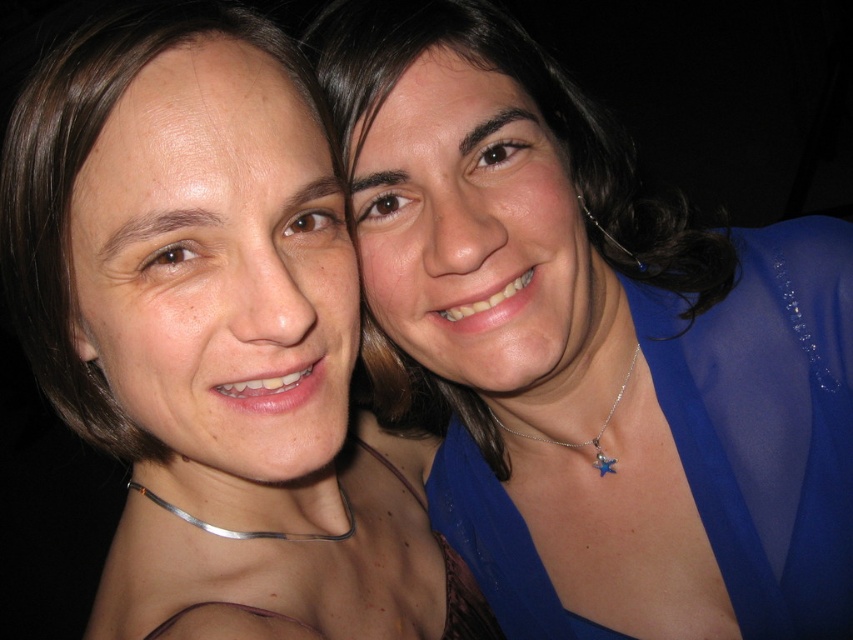
You are a photographer trying to adjust the lighting for a portrait. You notice the blue satin blouse at upper right is positioned at a certain coordinate. To ensure proper exposure, you need to know if the blouse is closer to the top or bottom of the frame. Can you determine this based on its position?

The blue satin blouse at upper right is located at point (x=213, y=339). Since the y coordinate 0.252 is closer to the top of the frame, the blouse is positioned closer to the top.

You are a photographer trying to adjust the spacing between the two blue satin garments in the image. The blue satin blouse at upper right and the blue satin dress at right are currently 9.58 inches apart. If you want to create a more cohesive look by reducing the distance between them, what is the minimum distance you should aim for to ensure they appear connected?

To ensure the blue satin blouse at upper right and the blue satin dress at right appear connected, you should aim to reduce the distance between them to less than 9.58 inches, ideally positioning them close enough so there is no gap visible between the two garments.